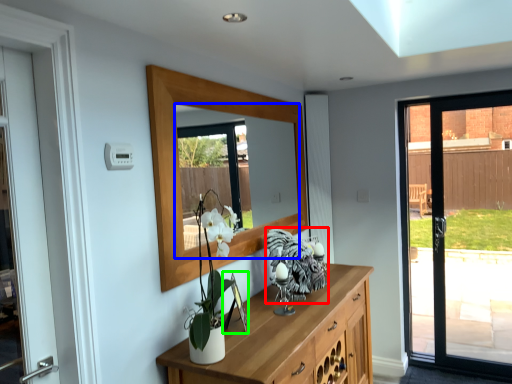
Question: Which is nearer to the animal (highlighted by a red box)? mirror (highlighted by a blue box) or picture frame (highlighted by a green box).

Choices:
 (A) mirror
 (B) picture frame

Answer: (B)